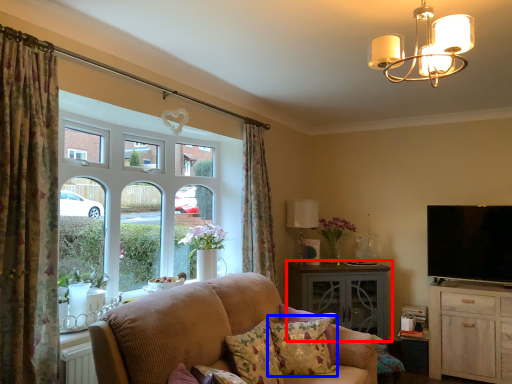
Question: Which object is closer to the camera taking this photo, table (highlighted by a red box) or pillow (highlighted by a blue box)?

Choices:
 (A) table
 (B) pillow

Answer: (B)